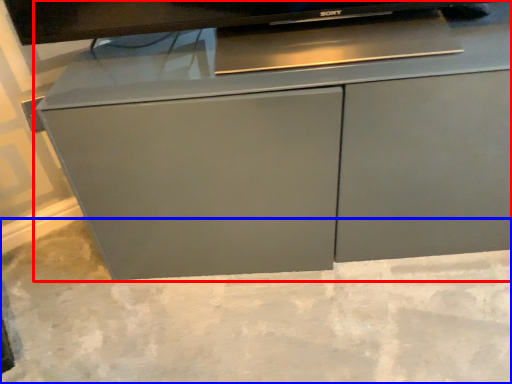
Question: Which object is closer to the camera taking this photo, cabinetry (highlighted by a red box) or concrete (highlighted by a blue box)?

Choices:
 (A) cabinetry
 (B) concrete

Answer: (B)